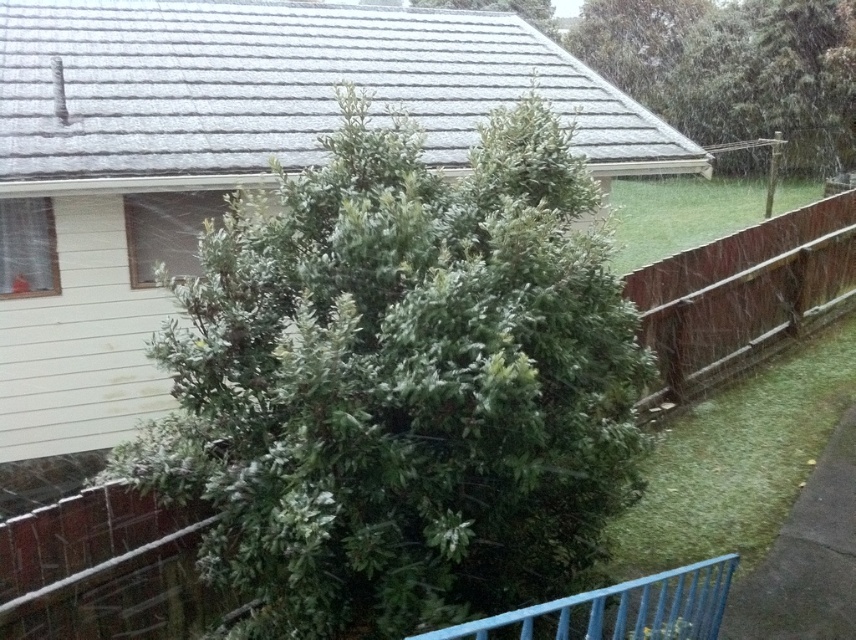
Question: Considering the real-world distances, which object is farthest from the green leafy tree at center?

Choices:
 (A) brown wooden fence at right
 (B) green leafy tree at upper center

Answer: (B)

Question: Does green leafy tree at center appear on the left side of blue painted metal fence at lower center?

Choices:
 (A) no
 (B) yes

Answer: (B)

Question: Which point is farther to the camera?

Choices:
 (A) blue painted metal fence at lower center
 (B) brown wooden fence at right
 (C) green leafy tree at center

Answer: (B)

Question: Does green leafy tree at upper center come behind brown wooden fence at right?

Choices:
 (A) yes
 (B) no

Answer: (A)

Question: Can you confirm if green leafy tree at center is positioned to the left of green leafy tree at upper center?

Choices:
 (A) no
 (B) yes

Answer: (B)

Question: Which of the following is the farthest from the observer?

Choices:
 (A) green leafy tree at upper center
 (B) brown wooden fence at right
 (C) blue painted metal fence at lower center
 (D) green leafy tree at center

Answer: (A)